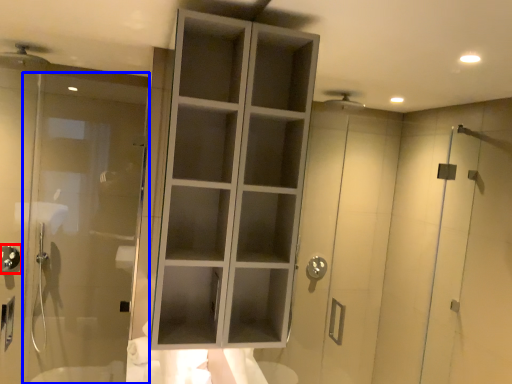
Question: Which of the following is the closest to the observer, shower (highlighted by a red box) or door (highlighted by a blue box)?

Choices:
 (A) shower
 (B) door

Answer: (B)